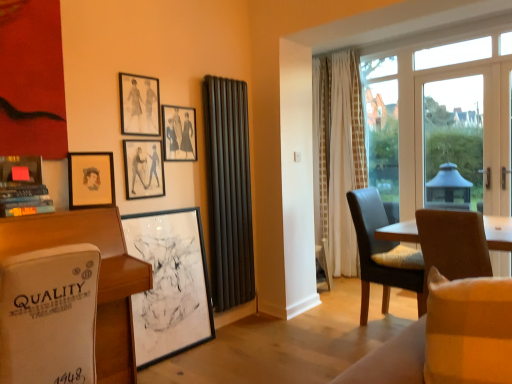
Question: Which direction should I rotate to face matte black picture frame at upper center, the 4th picture frame in the bottom-to-top sequence, — up or down?

Choices:
 (A) down
 (B) up

Answer: (B)

Question: From a real-world perspective, is matte brown chair at right, which is the 1th chair from back to front, positioned over matte black picture frame at upper left, the 5th picture frame in the bottom-to-top sequence, based on gravity?

Choices:
 (A) no
 (B) yes

Answer: (A)

Question: Are matte brown chair at right, which is the 1th chair from back to front, and matte black picture frame at upper left, the 5th picture frame in the bottom-to-top sequence, far apart?

Choices:
 (A) yes
 (B) no

Answer: (A)

Question: Does matte brown chair at right, placed as the 2th chair when sorted from front to back, come in front of matte black picture frame at upper left, arranged as the first picture frame when viewed from the top?

Choices:
 (A) yes
 (B) no

Answer: (B)

Question: Considering the relative positions of matte brown chair at right, which is the 1th chair from back to front, and matte black picture frame at upper left, arranged as the first picture frame when viewed from the top, in the image provided, is matte brown chair at right, which is the 1th chair from back to front, to the left of matte black picture frame at upper left, arranged as the first picture frame when viewed from the top, from the viewer's perspective?

Choices:
 (A) yes
 (B) no

Answer: (B)

Question: Is matte brown chair at right, which is the 1th chair from back to front, taller than matte black picture frame at upper left, the 5th picture frame in the bottom-to-top sequence?

Choices:
 (A) yes
 (B) no

Answer: (A)

Question: Does matte brown chair at right, placed as the 2th chair when sorted from front to back, have a lesser height compared to matte black picture frame at upper left, arranged as the first picture frame when viewed from the top?

Choices:
 (A) no
 (B) yes

Answer: (A)

Question: Is transparent glass window at center, acting as the first window screen starting from the left, taller than matte black picture frame at upper left, the 5th picture frame in the bottom-to-top sequence?

Choices:
 (A) no
 (B) yes

Answer: (B)

Question: Is transparent glass window at center, which is counted as the 2th window screen, starting from the front, turned away from matte black picture frame at upper left, the 5th picture frame in the bottom-to-top sequence?

Choices:
 (A) yes
 (B) no

Answer: (B)

Question: Is transparent glass window at center, which is counted as the second window screen, starting from the right, outside of matte black picture frame at upper left, arranged as the first picture frame when viewed from the top?

Choices:
 (A) yes
 (B) no

Answer: (A)

Question: From a real-world perspective, is transparent glass window at center, which is counted as the second window screen, starting from the right, under matte black picture frame at upper left, arranged as the first picture frame when viewed from the top?

Choices:
 (A) no
 (B) yes

Answer: (B)

Question: Is transparent glass window at center, which ranks as the 1th window screen in back-to-front order, shorter than matte black picture frame at upper left, arranged as the first picture frame when viewed from the top?

Choices:
 (A) no
 (B) yes

Answer: (A)

Question: From the image's perspective, would you say transparent glass window at center, which is counted as the 2th window screen, starting from the front, is positioned over matte black picture frame at upper left, arranged as the first picture frame when viewed from the top?

Choices:
 (A) no
 (B) yes

Answer: (A)

Question: Can we say matte brown chair at right, placed as the 2th chair when sorted from front to back, lies outside white glass door at right, the 2th window screen from the left?

Choices:
 (A) yes
 (B) no

Answer: (A)